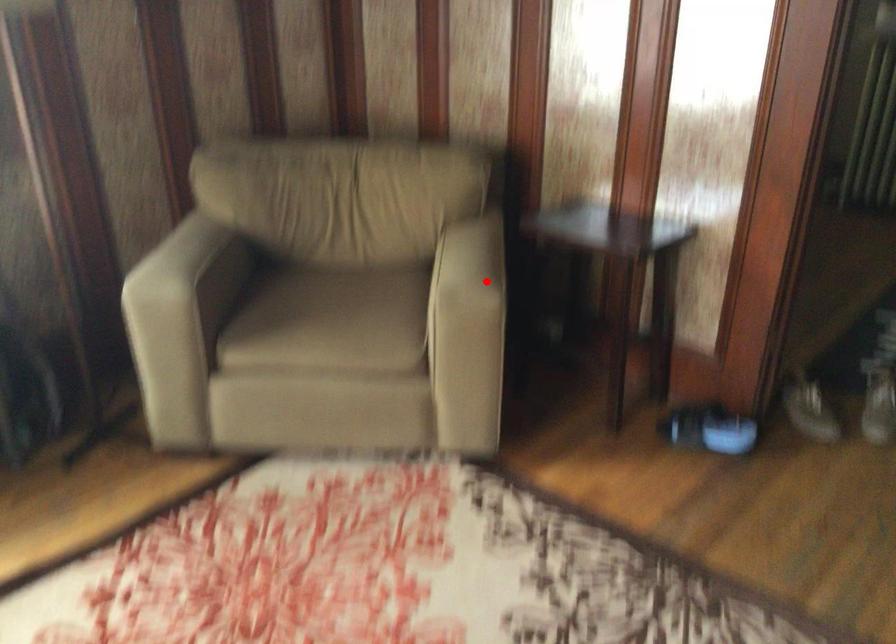
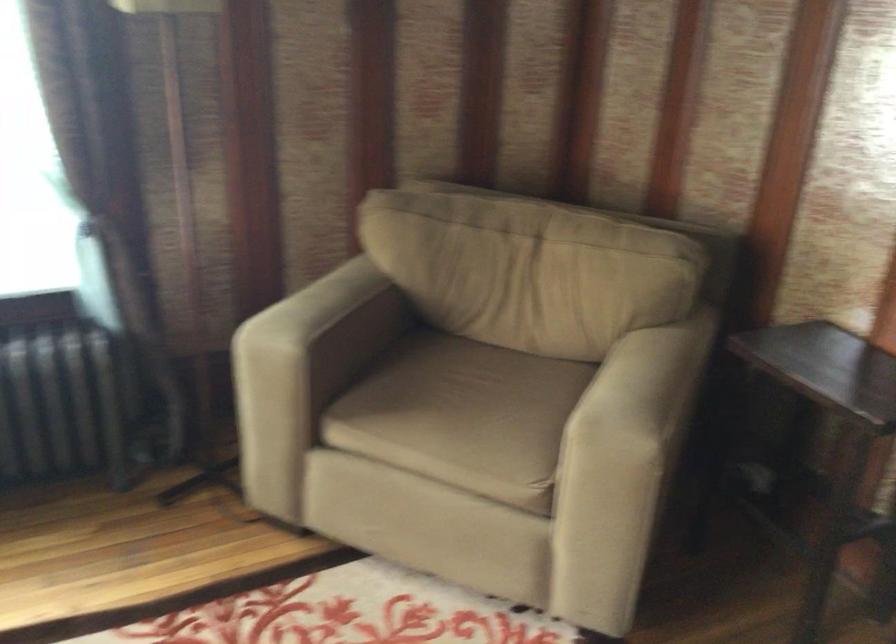
Question: I am providing you with two images of the same scene from different viewpoints. In image1, a red point is highlighted. Considering the same 3D point in image2, which of the following is correct?

Choices:
 (A) It is closer
 (B) It is farther

Answer: (A)